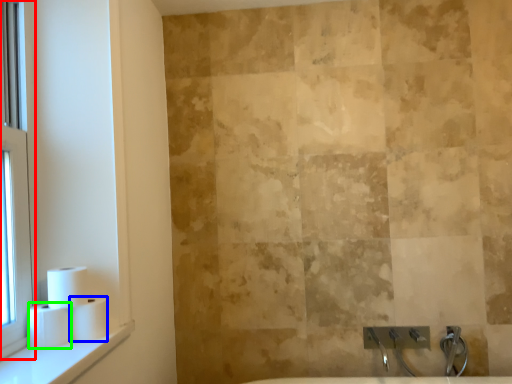
Question: Based on their relative distances, which object is farther from window (highlighted by a red box)? Choose from toilet paper (highlighted by a blue box) and toilet paper (highlighted by a green box).

Choices:
 (A) toilet paper
 (B) toilet paper

Answer: (A)